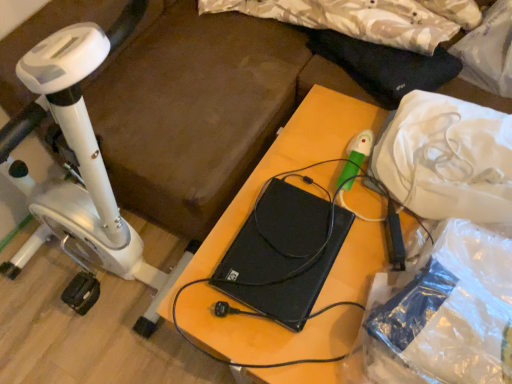
I want to click on white plastic bag at upper right, so click(447, 159).

This screenshot has height=384, width=512. I want to click on white plastic stationary bicycle at left, so click(x=78, y=171).

This screenshot has width=512, height=384. Describe the element at coordinates (78, 171) in the screenshot. I see `white plastic stationary bicycle at left` at that location.

The image size is (512, 384). What are the coordinates of `black matte laptop at center` in the screenshot? It's located at (301, 153).

What do you see at coordinates (283, 254) in the screenshot? The height and width of the screenshot is (384, 512). I see `black matte laptop at center` at bounding box center [283, 254].

The width and height of the screenshot is (512, 384). I want to click on white plastic bag at upper right, so click(447, 159).

Does point (466, 123) lie behind point (9, 150)?

Yes, it is behind point (9, 150).

Is white plastic bag at upper right further to the viewer compared to white plastic stationary bicycle at left?

Yes.

From the image's perspective, which object appears higher, white plastic bag at upper right or white plastic stationary bicycle at left?

white plastic bag at upper right is shown above in the image.

Which is closer to the camera, [81,307] or [308,156]?

Point [308,156]

From their relative heights in the image, would you say white plastic stationary bicycle at left is taller or shorter than black matte laptop at center?

Considering their sizes, white plastic stationary bicycle at left has more height than black matte laptop at center.

Measure the distance from white plastic stationary bicycle at left to black matte laptop at center.

They are 19.70 inches apart.

In terms of width, does white plastic stationary bicycle at left look wider or thinner when compared to white plastic bag at upper right?

In the image, white plastic stationary bicycle at left appears to be wider than white plastic bag at upper right.

Considering the positions of objects white plastic stationary bicycle at left and white plastic bag at upper right in the image provided, who is more to the left, white plastic stationary bicycle at left or white plastic bag at upper right?

white plastic stationary bicycle at left.

In the scene shown: From the image's perspective, is white plastic stationary bicycle at left above or below white plastic bag at upper right?

From the image's perspective, white plastic stationary bicycle at left appears below white plastic bag at upper right.

How different are the orientations of white plastic stationary bicycle at left and white plastic bag at upper right in degrees?

The facing directions of white plastic stationary bicycle at left and white plastic bag at upper right are 90.3 degrees apart.

Between white plastic bag at upper right and black matte laptop at center, which one has smaller width?

white plastic bag at upper right.

Is point (439, 96) closer to viewer compared to point (200, 336)?

No, it is not.

Considering the positions of objects white plastic bag at upper right and black matte laptop at center in the image provided, who is more to the right, white plastic bag at upper right or black matte laptop at center?

white plastic bag at upper right is more to the right.

Is white plastic bag at upper right taller or shorter than black matte laptop at center?

white plastic bag at upper right is shorter than black matte laptop at center.

Is white plastic bag at upper right at the back of black matte laptop at center?

No.

Can you confirm if black matte laptop at center is smaller than white plastic bag at upper right?

Yes.

Does point (223, 260) lie behind point (446, 117)?

That is False.

Looking at this image, does black matte laptop at center lie behind white plastic bag at upper right?

Yes, black matte laptop at center is further from the viewer.

Is black matte laptop at center located outside white plastic bag at upper right?

Yes, black matte laptop at center is not within white plastic bag at upper right.

From a real-world perspective, who is located higher, black matte laptop at center or white plastic bag at upper right?

From a 3D spatial view, white plastic bag at upper right is above.

From the image's perspective, is black matte laptop at center below white plastic bag at upper right?

Indeed, from the image's perspective, black matte laptop at center is shown beneath white plastic bag at upper right.

Measure the distance from black matte laptop at center to white plastic bag at upper right.

A distance of 8.81 inches exists between black matte laptop at center and white plastic bag at upper right.

Does black matte laptop at center lie behind white plastic stationary bicycle at left?

Yes, it is.

What's the angular difference between black matte laptop at center and white plastic stationary bicycle at left's facing directions?

They differ by 90.8 degrees in their facing directions.

Based on the photo, from the image's perspective, is black matte laptop at center below white plastic stationary bicycle at left?

Indeed, from the image's perspective, black matte laptop at center is shown beneath white plastic stationary bicycle at left.

From a real-world perspective, is black matte laptop at center on top of white plastic stationary bicycle at left?

No, from a real-world perspective, black matte laptop at center is not above white plastic stationary bicycle at left.

You are a GUI agent. You are given a task and a screenshot of the screen. Output one action in this format:
    pyautogui.click(x=<x>, y=<y>)
    Task: Click on the stationary bicycle on the left of white plastic bag at upper right
    
    Given the screenshot: What is the action you would take?
    pyautogui.click(x=78, y=171)

The width and height of the screenshot is (512, 384). In the image, there is a black matte laptop at center. In order to click on stationary bicycle above it (from the image's perspective) in this screenshot , I will do `click(78, 171)`.

Which object lies nearer to the anchor point black matte laptop at center, white plastic bag at upper right or black matte laptop at center?

black matte laptop at center.

Looking at the image, which one is located further to black matte laptop at center, white plastic bag at upper right or white plastic stationary bicycle at left?

Among the two, white plastic stationary bicycle at left is located further to black matte laptop at center.

Which object lies nearer to the anchor point black matte laptop at center, black matte laptop at center or white plastic stationary bicycle at left?

black matte laptop at center is positioned closer to the anchor black matte laptop at center.

When comparing their distances from white plastic stationary bicycle at left, does white plastic bag at upper right or black matte laptop at center seem closer?

black matte laptop at center is closer to white plastic stationary bicycle at left.

Considering their positions, is white plastic bag at upper right positioned further to white plastic stationary bicycle at left than black matte laptop at center?

white plastic bag at upper right.

From the image, which object appears to be farther from white plastic bag at upper right, black matte laptop at center or white plastic stationary bicycle at left?

white plastic stationary bicycle at left lies further to white plastic bag at upper right than the other object.

Which object lies further to the anchor point black matte laptop at center, white plastic stationary bicycle at left or black matte laptop at center?

white plastic stationary bicycle at left is further to black matte laptop at center.

From the image, which object appears to be farther from white plastic bag at upper right, black matte laptop at center or white plastic stationary bicycle at left?

white plastic stationary bicycle at left lies further to white plastic bag at upper right than the other object.

Find the location of a particular element. The width and height of the screenshot is (512, 384). table between white plastic stationary bicycle at left and white plastic bag at upper right from left to right is located at coordinates (301, 153).

Locate an element on the screen. Image resolution: width=512 pixels, height=384 pixels. computer located between white plastic stationary bicycle at left and white plastic bag at upper right in the left-right direction is located at coordinates (283, 254).

The image size is (512, 384). Identify the location of computer between white plastic stationary bicycle at left and black matte laptop at center in the horizontal direction. [x=283, y=254].

Image resolution: width=512 pixels, height=384 pixels. I want to click on table between black matte laptop at center and white plastic bag at upper right, so click(x=301, y=153).